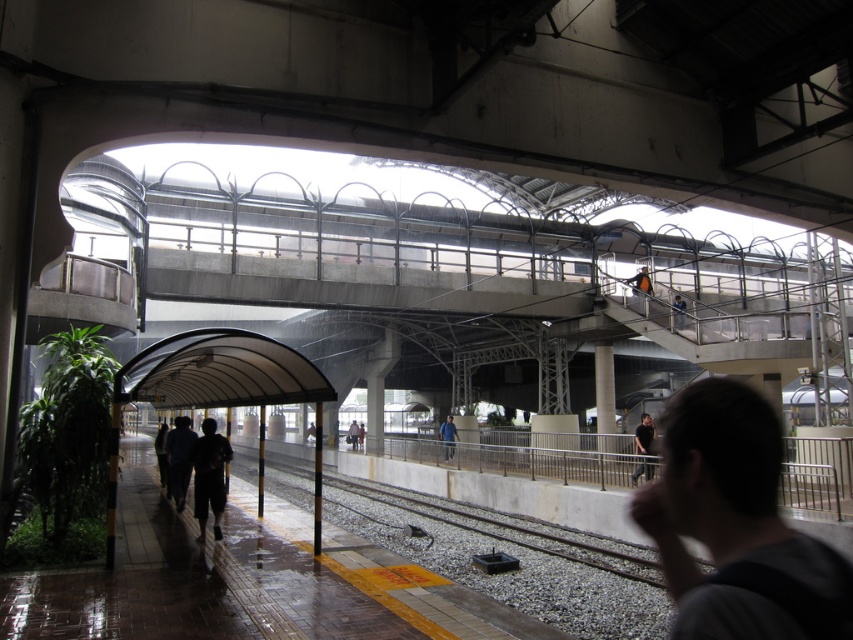
Between dark gray pants at center and blue denim jacket at upper center, which one is positioned higher?

blue denim jacket at upper center is above.

This screenshot has height=640, width=853. Describe the element at coordinates (209, 476) in the screenshot. I see `dark gray pants at center` at that location.

Between point (201, 445) and point (676, 310), which one is positioned in front?

Positioned in front is point (201, 445).

You are a GUI agent. You are given a task and a screenshot of the screen. Output one action in this format:
    pyautogui.click(x=<x>, y=<y>)
    Task: Click on the dark gray pants at center
    The height and width of the screenshot is (640, 853).
    Given the screenshot: What is the action you would take?
    (209, 476)

Is the position of dark gray hoodie at center more distant than that of blue fabric jacket at center?

No, dark gray hoodie at center is in front of blue fabric jacket at center.

Which is in front, point (770, 449) or point (445, 424)?

Point (770, 449) is in front.

Where is `dark gray hoodie at center`? The width and height of the screenshot is (853, 640). dark gray hoodie at center is located at coordinates (735, 524).

Who is more forward, [683,470] or [207,442]?

Point [683,470] is more forward.

Based on the photo, does dark gray hoodie at center have a smaller size compared to dark gray pants at center?

Actually, dark gray hoodie at center might be larger than dark gray pants at center.

Who is more forward, (715, 509) or (202, 476)?

Point (715, 509) is in front.

I want to click on dark gray hoodie at center, so click(x=735, y=524).